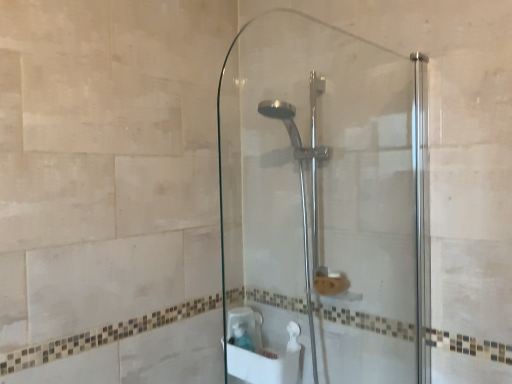
Question: Is polished chrome shower head at center in front of or behind transparent glass shower door at center in the image?

Choices:
 (A) behind
 (B) front

Answer: (A)

Question: From the image's perspective, is polished chrome shower head at center positioned above or below transparent glass shower door at center?

Choices:
 (A) below
 (B) above

Answer: (A)

Question: Considering the positions of polished chrome shower head at center and transparent glass shower door at center in the image, is polished chrome shower head at center wider or thinner than transparent glass shower door at center?

Choices:
 (A) thin
 (B) wide

Answer: (B)

Question: Does point pyautogui.click(x=258, y=39) appear closer or farther from the camera than point pyautogui.click(x=306, y=269)?

Choices:
 (A) closer
 (B) farther

Answer: (B)

Question: Based on their positions, is transparent glass shower door at center located to the left or right of polished chrome shower head at center?

Choices:
 (A) left
 (B) right

Answer: (B)

Question: From the image's perspective, is transparent glass shower door at center located above or below polished chrome shower head at center?

Choices:
 (A) above
 (B) below

Answer: (A)

Question: From a real-world perspective, is transparent glass shower door at center physically located above or below polished chrome shower head at center?

Choices:
 (A) below
 (B) above

Answer: (B)